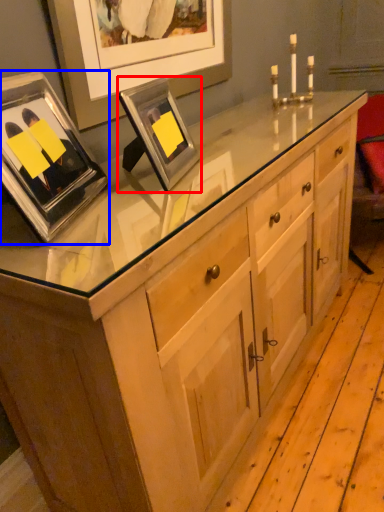
Question: Which object appears closest to the camera in this image, picture frame (highlighted by a red box) or picture frame (highlighted by a blue box)?

Choices:
 (A) picture frame
 (B) picture frame

Answer: (B)